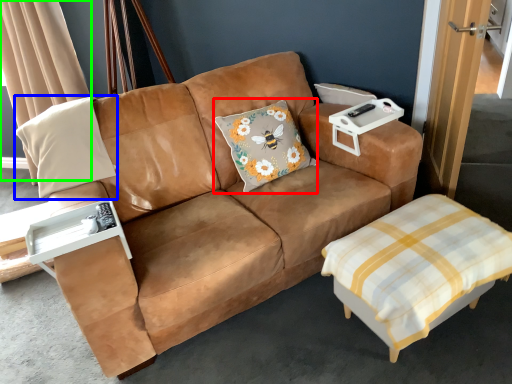
Question: Which object is the closest to the throw pillow (highlighted by a red box)? Choose among these: pillow (highlighted by a blue box) or curtain (highlighted by a green box).

Choices:
 (A) pillow
 (B) curtain

Answer: (A)